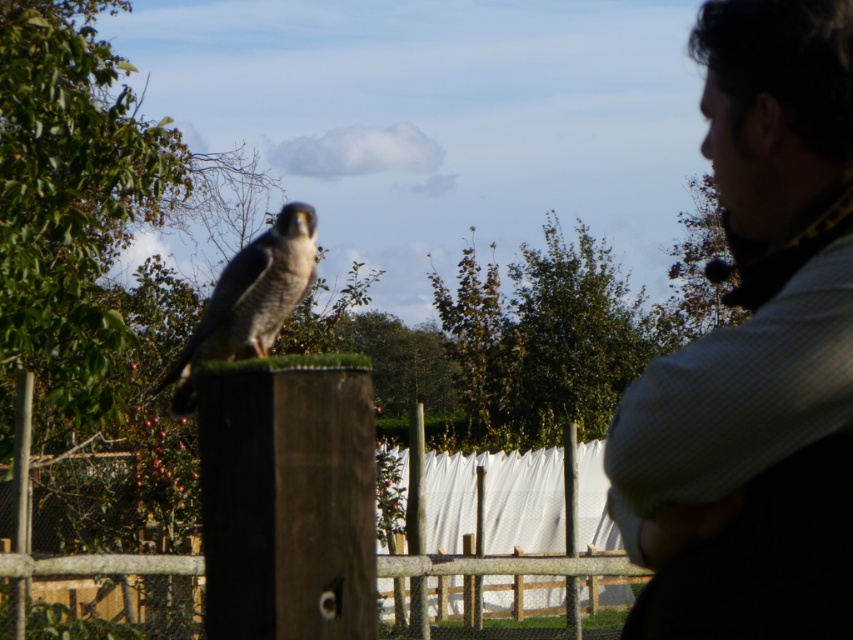
Question: Observing the image, what is the correct spatial positioning of checkered fabric shirt at right in reference to dark brown feathers at center?

Choices:
 (A) left
 (B) right

Answer: (B)

Question: Can you confirm if checkered fabric shirt at right is positioned above dark brown feathers at center?

Choices:
 (A) no
 (B) yes

Answer: (B)

Question: Does checkered fabric shirt at right have a greater width compared to dark brown feathers at center?

Choices:
 (A) no
 (B) yes

Answer: (A)

Question: Which of the following is the closest to the observer?

Choices:
 (A) dark brown feathers at center
 (B) checkered fabric shirt at right

Answer: (B)

Question: Which point is closer to the camera?

Choices:
 (A) (785, 470)
 (B) (224, 349)

Answer: (A)

Question: Among these objects, which one is farthest from the camera?

Choices:
 (A) checkered fabric shirt at right
 (B) dark brown feathers at center

Answer: (B)